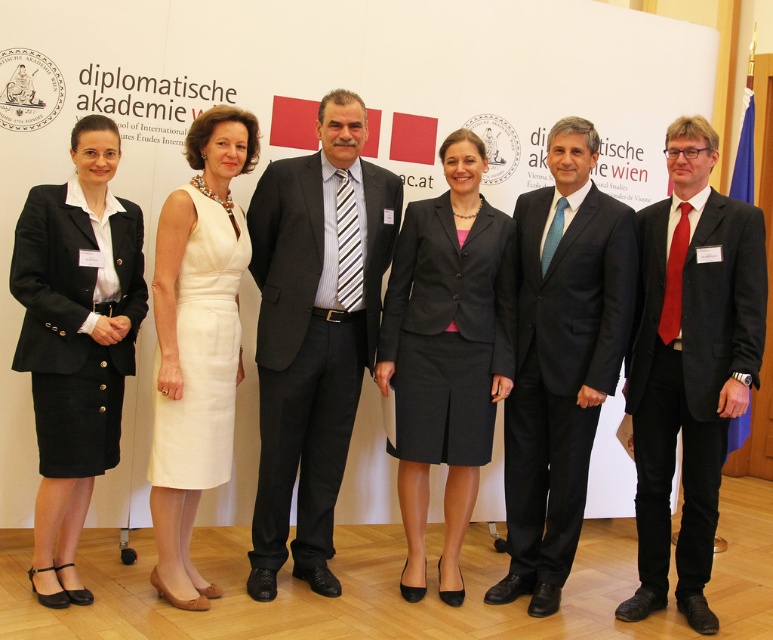
Question: Can you confirm if matte black suit at center is positioned to the right of matte black suit at right?

Choices:
 (A) no
 (B) yes

Answer: (A)

Question: Can you confirm if dark gray wool suit at center is bigger than black wool suit at center?

Choices:
 (A) yes
 (B) no

Answer: (A)

Question: Which of the following is the farthest from the observer?

Choices:
 (A) (431, 273)
 (B) (703, 248)
 (C) (43, 330)
 (D) (239, 156)

Answer: (A)

Question: Considering the real-world distances, which object is farthest from the black corduroy business suit at left?

Choices:
 (A) black wool suit at center
 (B) white textured dress at center
 (C) matte black suit at center
 (D) matte black suit at right

Answer: (D)

Question: Which of these objects is positioned closest to the dark gray wool suit at center?

Choices:
 (A) white textured dress at center
 (B) black corduroy business suit at left
 (C) matte black suit at right
 (D) matte black suit at center

Answer: (A)

Question: Observing the image, what is the correct spatial positioning of matte black suit at right in reference to white textured dress at center?

Choices:
 (A) below
 (B) above

Answer: (A)